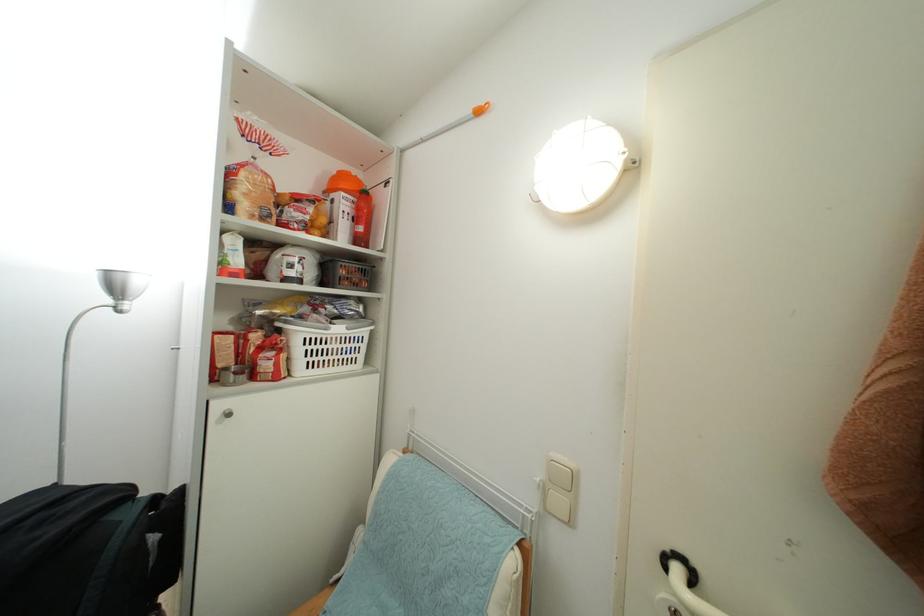
Where would you lift the bag of bread? Please return your answer as a coordinate pair (x, y).

(249, 192)